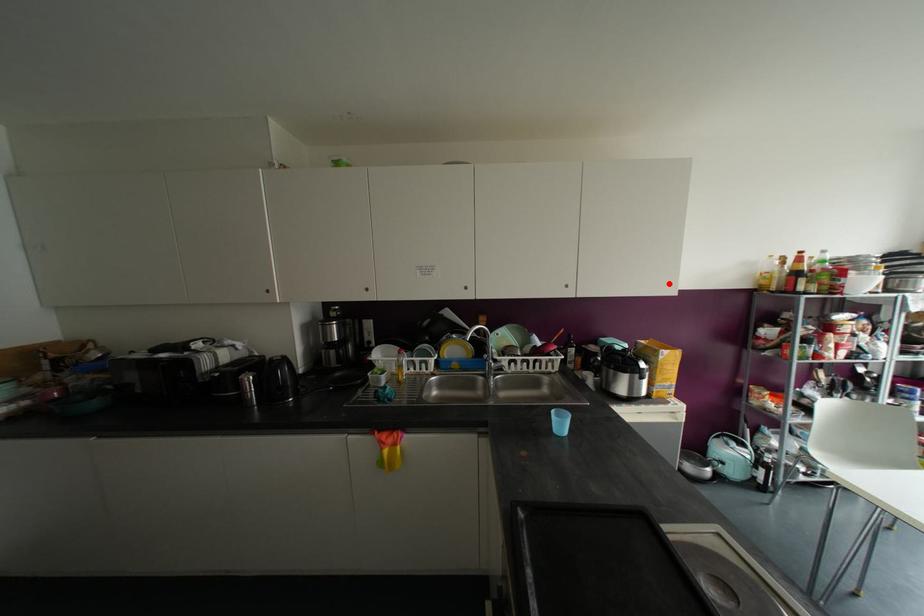
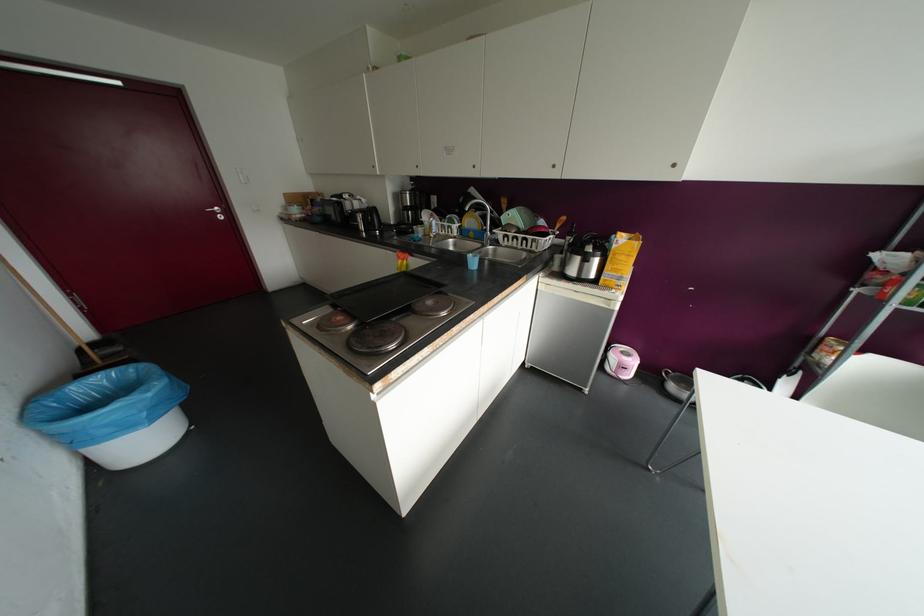
Find the pixel in the second image that matches the highlighted location in the first image.

(673, 164)